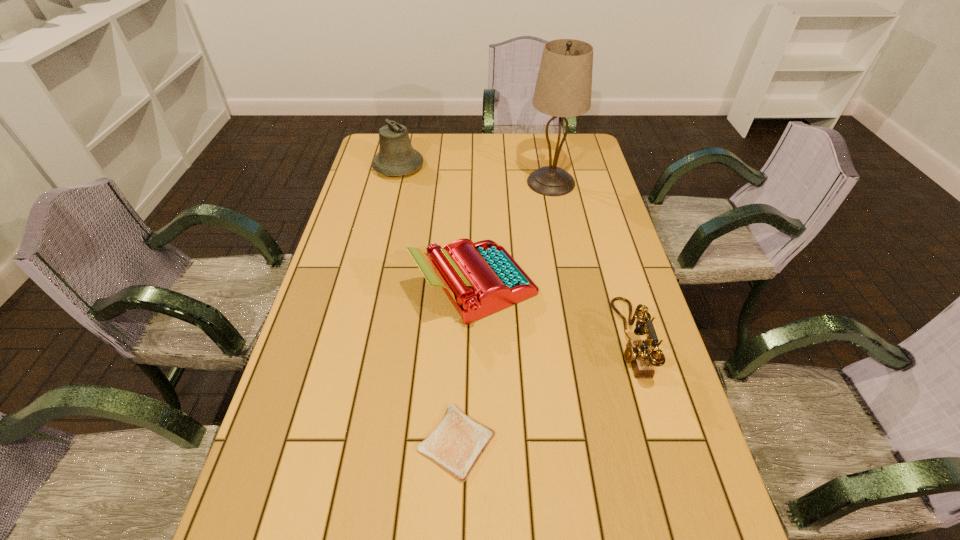
The height and width of the screenshot is (540, 960). I want to click on vacant region located on the typing side of the typewriter, so click(610, 286).

The width and height of the screenshot is (960, 540). I want to click on free point located 0.050m on the front-facing side of the telephone, so click(598, 340).

Where is `free spot located on the front-facing side of the telephone`? This screenshot has height=540, width=960. free spot located on the front-facing side of the telephone is located at coordinates (542, 340).

Locate an element on the screen. The image size is (960, 540). vacant space located on the front-facing side of the telephone is located at coordinates (570, 340).

The image size is (960, 540). What are the coordinates of `vacant region located 0.140m on the left of the nearest object` in the screenshot? It's located at (352, 442).

The width and height of the screenshot is (960, 540). I want to click on object at the far edge, so click(396, 157).

You are a GUI agent. You are given a task and a screenshot of the screen. Output one action in this format:
    pyautogui.click(x=<x>, y=<y>)
    Task: Click on the object located at the left edge
    Image resolution: width=960 pixels, height=540 pixels.
    Given the screenshot: What is the action you would take?
    pyautogui.click(x=396, y=157)

The width and height of the screenshot is (960, 540). I want to click on lampshade that is at the right edge, so click(563, 89).

This screenshot has width=960, height=540. What are the coordinates of `telephone present at the right edge` in the screenshot? It's located at [637, 353].

You are a GUI agent. You are given a task and a screenshot of the screen. Output one action in this format:
    pyautogui.click(x=<x>, y=<y>)
    Task: Click on the object located in the far left corner section of the desktop
    
    Given the screenshot: What is the action you would take?
    pyautogui.click(x=396, y=157)